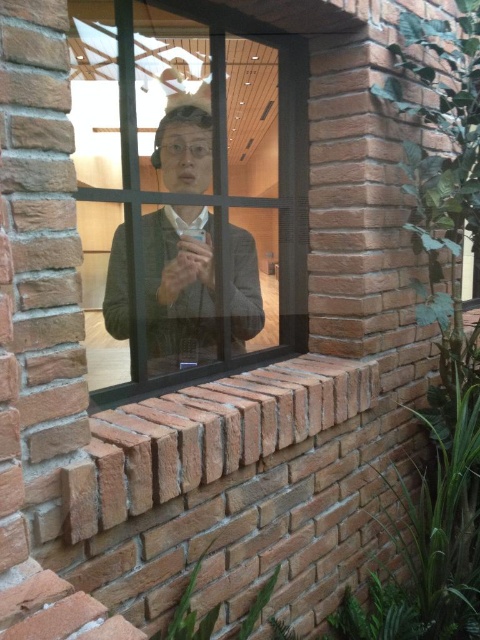
Can you confirm if clear glass window at center is shorter than matte gray jacket at center?

No.

Where is `clear glass window at center`? clear glass window at center is located at coordinates (190, 188).

In order to click on clear glass window at center in this screenshot , I will do `click(190, 188)`.

Where is `clear glass window at center`? Image resolution: width=480 pixels, height=640 pixels. clear glass window at center is located at coordinates pos(190,188).